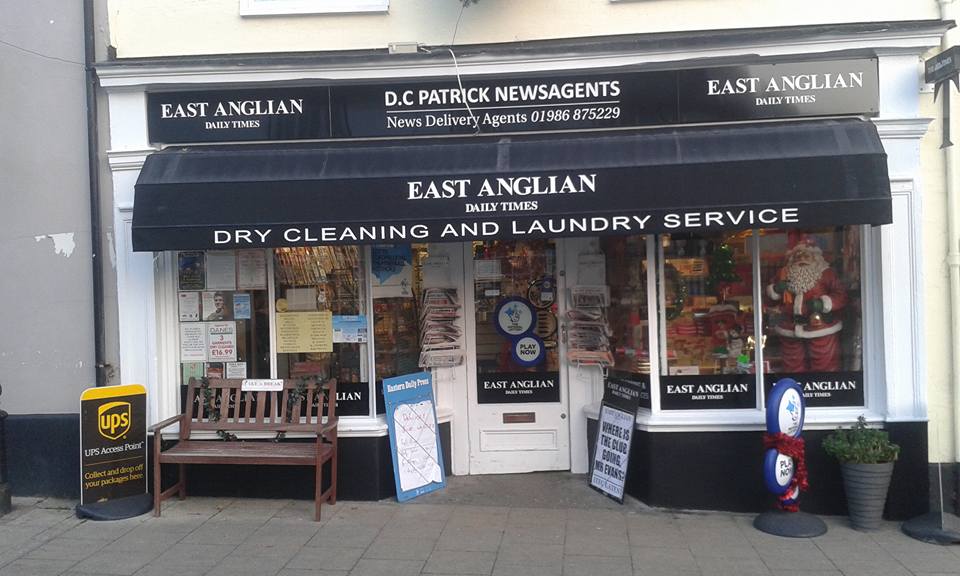
This screenshot has width=960, height=576. I want to click on area to sit on brown bench, so click(254, 447).